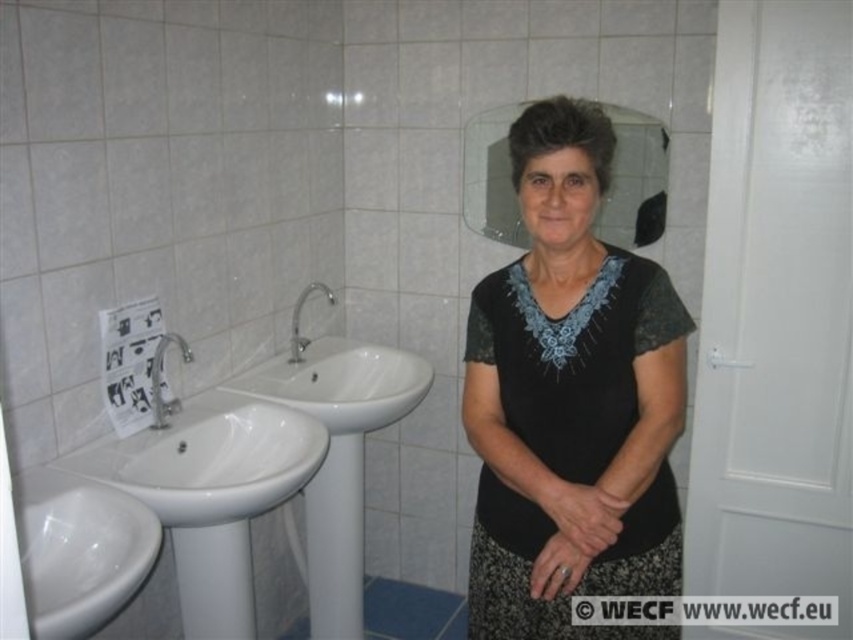
You are a plumber inspecting the bathroom. You need to locate the silver metallic faucet at center to check for leaks. Where should you look in relation to the white glossy sink at center?

The silver metallic faucet at center is above the white glossy sink at center, so you should look above the white glossy sink at center to find the silver metallic faucet at center.

You are a fashion designer who needs to create a display stand for the black lace dress at center and the white glossy sink at left. Since you want to ensure both items are visible, which item requires a larger display space?

The black lace dress at center requires a larger display space because it has a larger size compared to the white glossy sink at left.